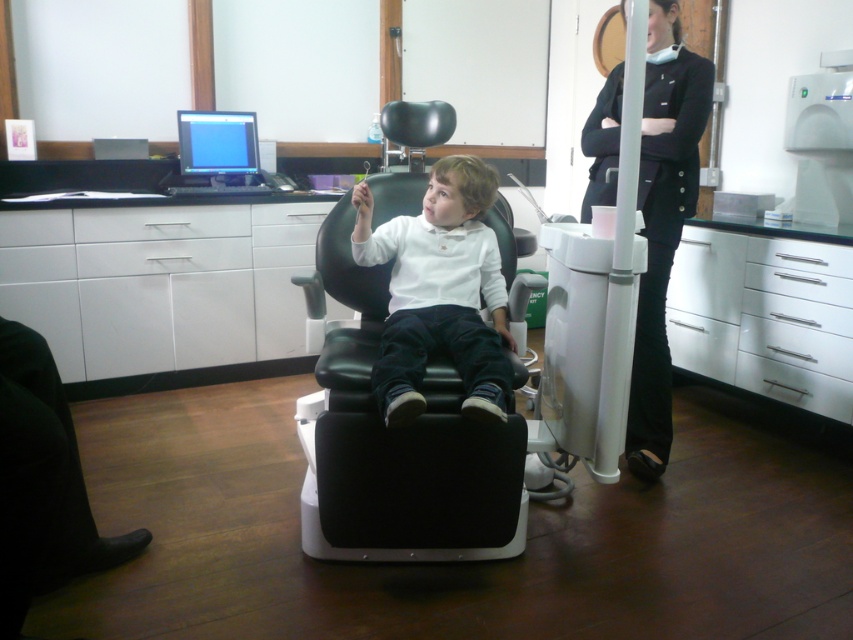
Who is positioned more to the left, white glossy shirt at center or black fabric pants at right?

From the viewer's perspective, white glossy shirt at center appears more on the left side.

Does white glossy shirt at center have a smaller size compared to black fabric pants at right?

Yes, white glossy shirt at center is smaller than black fabric pants at right.

Locate an element on the screen. white glossy shirt at center is located at coordinates (439, 291).

Is white glossy drawer at center further to the viewer compared to black fabric pants at right?

Yes, white glossy drawer at center is behind black fabric pants at right.

The width and height of the screenshot is (853, 640). Describe the element at coordinates (764, 316) in the screenshot. I see `white glossy drawer at center` at that location.

Where is `white glossy drawer at center`? The height and width of the screenshot is (640, 853). white glossy drawer at center is located at coordinates (764, 316).

How far apart are white glossy drawer at center and white glossy shirt at center?

white glossy drawer at center and white glossy shirt at center are 4.63 feet apart from each other.

Between point (666, 317) and point (476, 164), which one is positioned in front?

Positioned in front is point (476, 164).

Which is in front, point (769, 280) or point (444, 333)?

Point (444, 333) is more forward.

Identify the location of white glossy drawer at center. (764, 316).